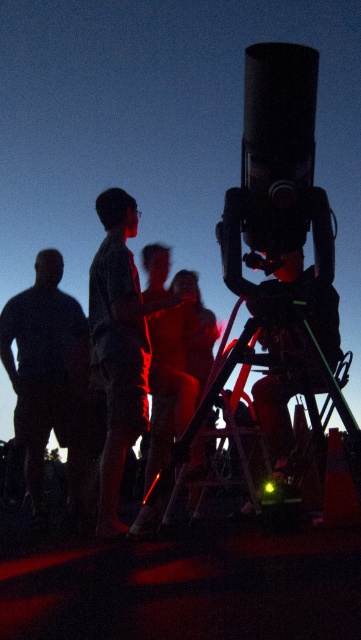
Question: Can you confirm if dark blue shirt at left is thinner than metallic tripod at center?

Choices:
 (A) yes
 (B) no

Answer: (A)

Question: Which point is closer to the camera taking this photo?

Choices:
 (A) (149, 490)
 (B) (145, 324)
 (C) (61, 260)

Answer: (A)

Question: Where is dark blue shirt at left located in relation to plaid shirt at center in the image?

Choices:
 (A) below
 (B) above

Answer: (A)

Question: Among these points, which one is farthest from the camera?

Choices:
 (A) (42, 452)
 (B) (277, 320)
 (C) (128, 378)

Answer: (A)

Question: Which of these objects is positioned farthest from the metallic tripod at center?

Choices:
 (A) dark blue shirt at left
 (B) plaid shirt at center

Answer: (A)

Question: Where is dark blue shirt at left located in relation to metallic tripod at center in the image?

Choices:
 (A) left
 (B) right

Answer: (A)